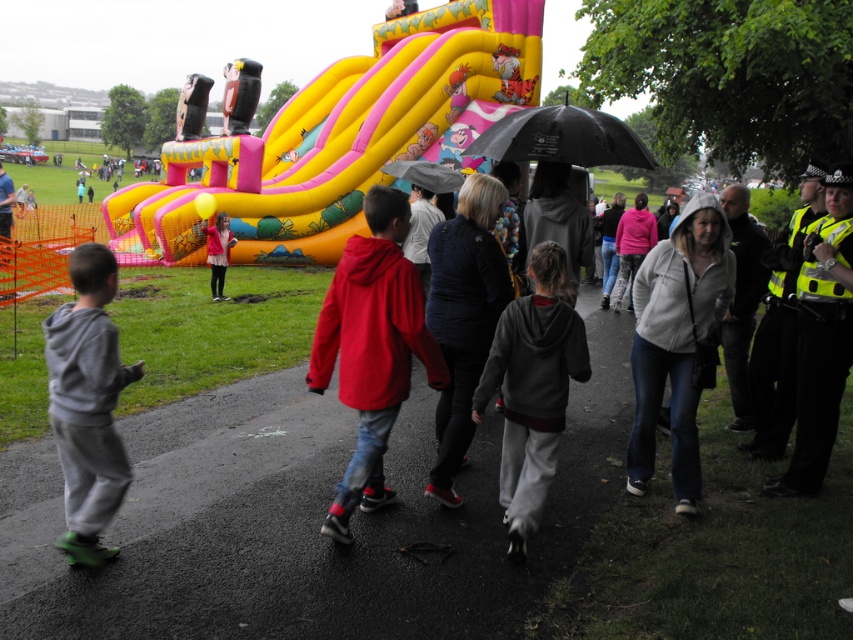
Question: Considering the relative positions of red matte jacket at center and matte pink hoodie at center in the image provided, where is red matte jacket at center located with respect to matte pink hoodie at center?

Choices:
 (A) right
 (B) left

Answer: (A)

Question: Is red matte jacket at center above gray fleece jacket at center?

Choices:
 (A) no
 (B) yes

Answer: (A)

Question: Is reflective yellow vest at right above matte pink hoodie at center?

Choices:
 (A) yes
 (B) no

Answer: (B)

Question: Based on their relative distances, which object is farther from the yellow inflatable slide at center?

Choices:
 (A) matte pink hoodie at center
 (B) black matte umbrella at upper center

Answer: (B)

Question: Which point appears closest to the camera in this image?

Choices:
 (A) (514, 360)
 (B) (734, 266)
 (C) (393, 170)
 (D) (811, 460)

Answer: (A)

Question: Among these points, which one is farthest from the camera?

Choices:
 (A) (434, 164)
 (B) (96, 502)
 (C) (662, 356)

Answer: (A)